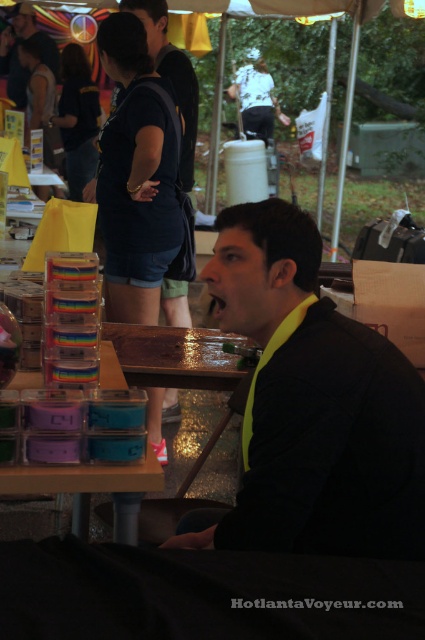
You are a vendor at the fair and need to place a 16 inch wide decorative item between the black matte jacket at center and the matte plastic containers at lower center. Is there enough space?

The distance between the black matte jacket at center and the matte plastic containers at lower center is 17.49 inches. Since the decorative item is 16 inches wide, there is sufficient space to place it between them.

You are standing in the fairground and see both the black matte jacket at center and the matte plastic containers at lower center. Which object is nearer to you?

The black matte jacket at center is closer to the viewer than the matte plastic containers at lower center.

In the scene shown: You are a photographer at the fair and want to capture both the black matte jacket at center and the matte plastic containers at lower center in a single shot. Given their sizes, which object should you focus on to ensure both are clearly visible?

Since the black matte jacket at center is larger in size than the matte plastic containers at lower center, you should focus on the black matte jacket at center to ensure both are clearly visible in the photo.